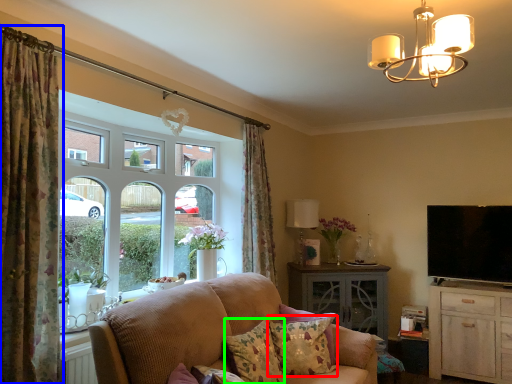
Question: Which object is positioned closest to pillow (highlighted by a red box)? Select from curtain (highlighted by a blue box) and pillow (highlighted by a green box).

Choices:
 (A) curtain
 (B) pillow

Answer: (B)